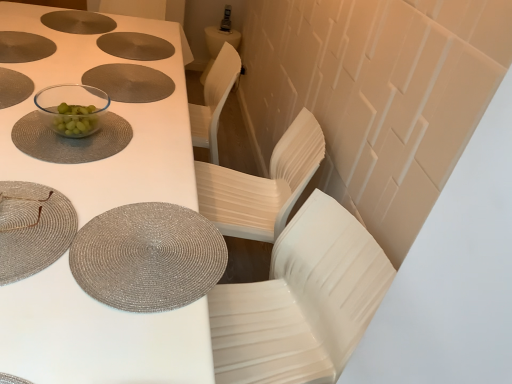
At what (x,y) coordinates should I click in order to perform the action: click on vacant position to the left of matte silver placemat at center. Please return your answer as a coordinate pair (x, y). The width and height of the screenshot is (512, 384). Looking at the image, I should click on (49, 71).